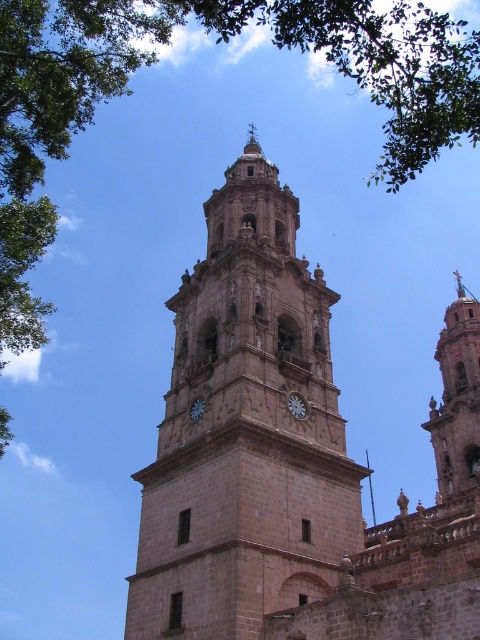
Question: Does green leafy tree at upper left appear on the right side of smooth stone tower at right?

Choices:
 (A) no
 (B) yes

Answer: (A)

Question: Does brown stone clock tower at center appear over smooth stone tower at right?

Choices:
 (A) yes
 (B) no

Answer: (A)

Question: Which point appears closest to the camera in this image?

Choices:
 (A) (192, 403)
 (B) (443, 490)

Answer: (A)

Question: Which point is closer to the camera?

Choices:
 (A) white stone clock at center
 (B) smooth stone tower at right
 (C) matte gray clock at center

Answer: (C)

Question: Among these objects, which one is farthest from the camera?

Choices:
 (A) brown stone clock tower at center
 (B) matte gray clock at center
 (C) white stone clock at center

Answer: (C)

Question: In this image, where is brown stone clock tower at center located relative to white stone clock at center?

Choices:
 (A) left
 (B) right

Answer: (B)